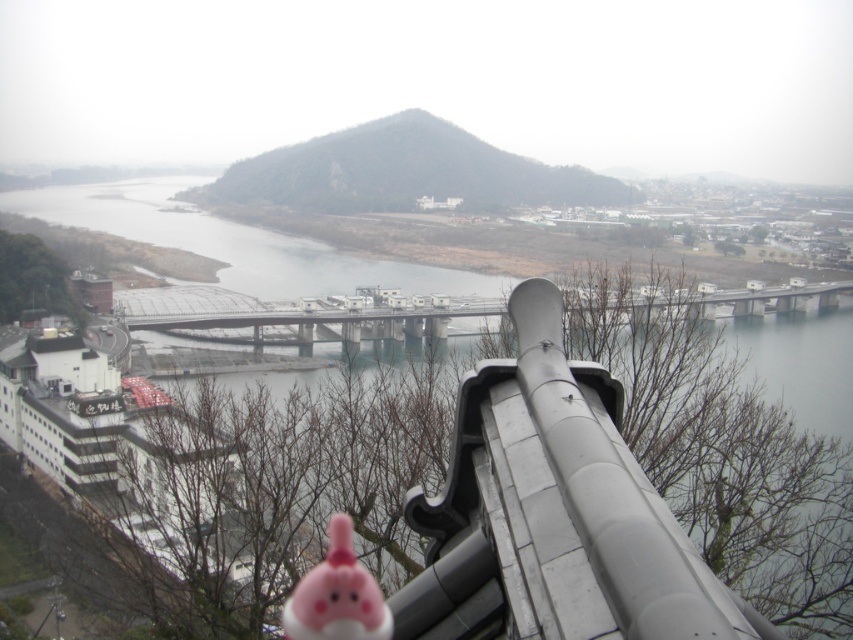
Can you confirm if clear water at bridge center is shorter than matte pink plushie at lower center?

In fact, clear water at bridge center may be taller than matte pink plushie at lower center.

Between clear water at bridge center and matte pink plushie at lower center, which one appears on the left side from the viewer's perspective?

clear water at bridge center is more to the left.

Where is `clear water at bridge center`? clear water at bridge center is located at coordinates (233, 241).

Which of these two, dark gray rocky peak at center or matte pink plushie at lower center, stands taller?

dark gray rocky peak at center is taller.

Measure the distance between dark gray rocky peak at center and camera.

dark gray rocky peak at center is 1299.42 feet away from camera.

Does point (425, 120) come behind point (341, 582)?

Yes.

Locate an element on the screen. Image resolution: width=853 pixels, height=640 pixels. dark gray rocky peak at center is located at coordinates (405, 172).

From the picture: Does clear water at bridge center have a smaller size compared to dark gray rocky peak at center?

Actually, clear water at bridge center might be larger than dark gray rocky peak at center.

What do you see at coordinates (233, 241) in the screenshot?
I see `clear water at bridge center` at bounding box center [233, 241].

Which is in front, point (55, 214) or point (582, 195)?

Point (582, 195) is in front.

The width and height of the screenshot is (853, 640). In order to click on clear water at bridge center in this screenshot , I will do `click(233, 241)`.